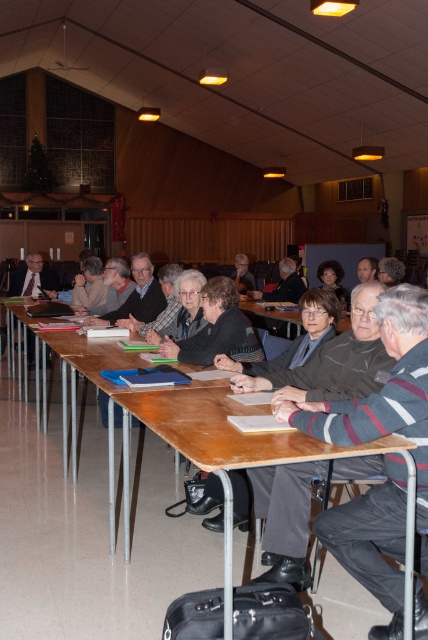
In the scene shown: You are standing at the point labeled point [44,416] in the community hall. You want to move to the front of the room, which is 5 meters away from your current position. Can you reach the front without moving more than 5 meters?

The distance between point [44,416] and the viewer is 4.84 meters, so yes, you can reach the front without exceeding 5 meters since the distance is slightly less than the required limit.